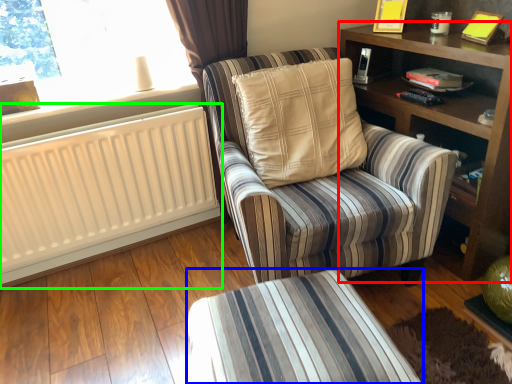
Question: Considering the real-world distances, which object is farthest from shelf (highlighted by a red box)? table (highlighted by a blue box) or radiator (highlighted by a green box)?

Choices:
 (A) table
 (B) radiator

Answer: (B)